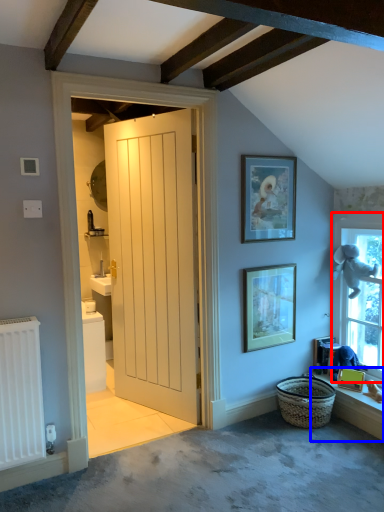
Question: Which object appears closest to the camera in this image, window (highlighted by a red box) or window sill (highlighted by a blue box)?

Choices:
 (A) window
 (B) window sill

Answer: (B)